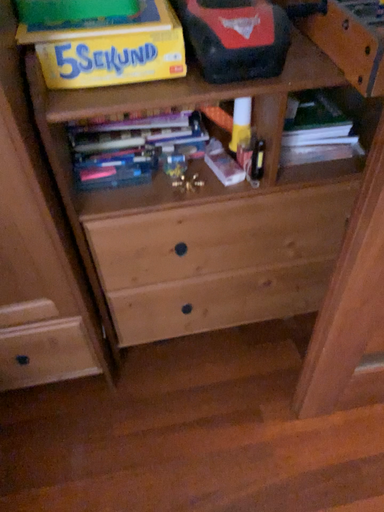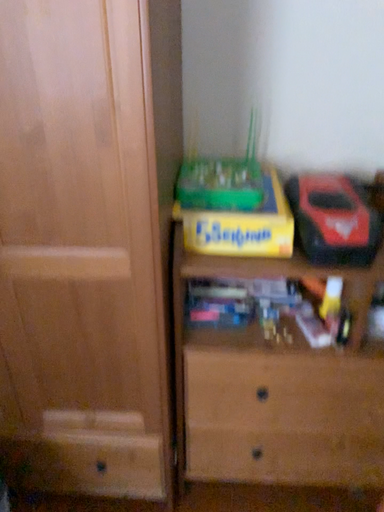
Question: Which way did the camera rotate in the video?

Choices:
 (A) rotated downward
 (B) rotated upward

Answer: (B)